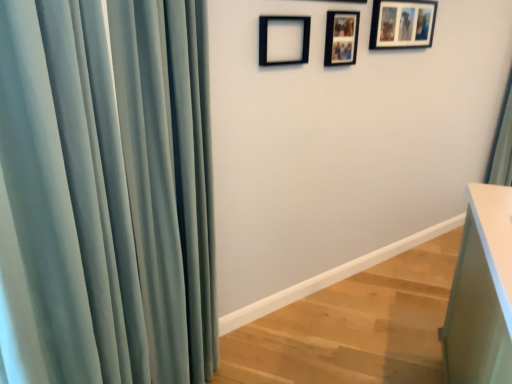
Question: Is matte black picture frame at upper right, which is the third picture frame in front-to-back order, to the left of satin teal curtain at left from the viewer's perspective?

Choices:
 (A) no
 (B) yes

Answer: (A)

Question: Considering the relative positions of matte black picture frame at upper right, which is the first picture frame from right to left, and satin teal curtain at left in the image provided, is matte black picture frame at upper right, which is the first picture frame from right to left, behind satin teal curtain at left?

Choices:
 (A) yes
 (B) no

Answer: (A)

Question: Is matte black picture frame at upper right, the first picture frame in the back-to-front sequence, to the right of satin teal curtain at left from the viewer's perspective?

Choices:
 (A) yes
 (B) no

Answer: (A)

Question: Considering the relative sizes of matte black picture frame at upper right, which is the first picture frame from right to left, and satin teal curtain at left in the image provided, is matte black picture frame at upper right, which is the first picture frame from right to left, wider than satin teal curtain at left?

Choices:
 (A) yes
 (B) no

Answer: (B)

Question: Can you see matte black picture frame at upper right, the first picture frame in the back-to-front sequence, touching satin teal curtain at left?

Choices:
 (A) no
 (B) yes

Answer: (A)

Question: Considering their positions, is satin teal curtain at left located in front of or behind wooden photo frame at upper center, which is counted as the 2th picture frame, starting from the left?

Choices:
 (A) front
 (B) behind

Answer: (A)

Question: Is satin teal curtain at left bigger or smaller than wooden photo frame at upper center, arranged as the 2th picture frame when viewed from the right?

Choices:
 (A) big
 (B) small

Answer: (A)

Question: From their relative heights in the image, would you say satin teal curtain at left is taller or shorter than wooden photo frame at upper center, which is counted as the 2th picture frame, starting from the left?

Choices:
 (A) tall
 (B) short

Answer: (A)

Question: From a real-world perspective, is satin teal curtain at left above or below wooden photo frame at upper center, which is the 2th picture frame from front to back?

Choices:
 (A) above
 (B) below

Answer: (B)

Question: Is matte black picture frame at upper right, which is the third picture frame in left-to-right order, in front of or behind wooden photo frame at upper center, which is the 2th picture frame from front to back, in the image?

Choices:
 (A) behind
 (B) front

Answer: (A)

Question: Is matte black picture frame at upper right, which is the first picture frame from right to left, bigger or smaller than wooden photo frame at upper center, the 2th picture frame viewed from the back?

Choices:
 (A) big
 (B) small

Answer: (A)

Question: From their relative heights in the image, would you say matte black picture frame at upper right, the first picture frame in the back-to-front sequence, is taller or shorter than wooden photo frame at upper center, which is counted as the 2th picture frame, starting from the left?

Choices:
 (A) tall
 (B) short

Answer: (A)

Question: Considering the positions of point (406, 9) and point (344, 19), is point (406, 9) closer or farther from the camera than point (344, 19)?

Choices:
 (A) closer
 (B) farther

Answer: (B)

Question: Is point (448, 331) closer or farther from the camera than point (410, 24)?

Choices:
 (A) farther
 (B) closer

Answer: (B)

Question: Which is correct: white glossy vanity at lower right is inside matte black picture frame at upper right, which is the first picture frame from right to left, or outside of it?

Choices:
 (A) inside
 (B) outside

Answer: (B)